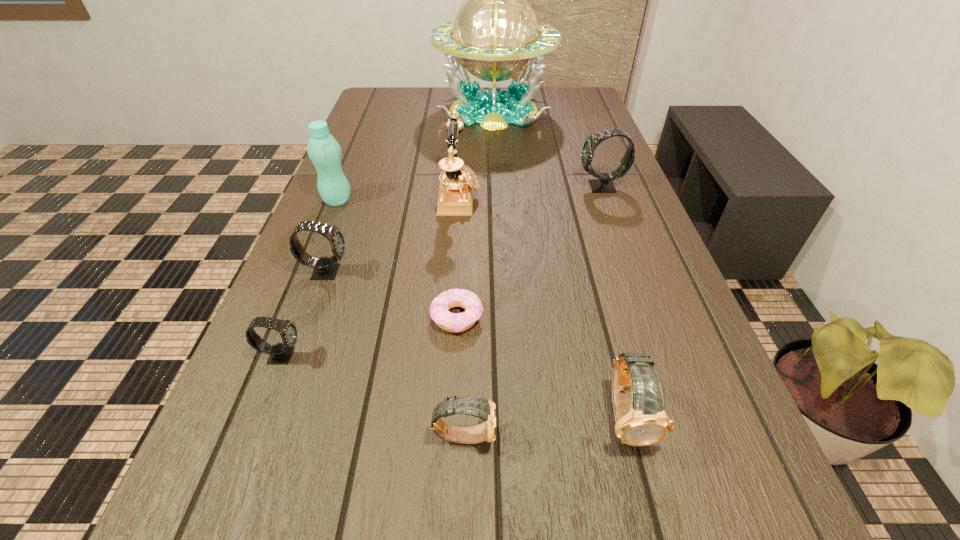
I want to click on free space at the far edge of the desktop, so click(428, 113).

Find the location of a particular element. vacant space at the left edge of the desktop is located at coordinates (380, 130).

Locate an element on the screen. This screenshot has width=960, height=540. blank area at the right edge is located at coordinates (621, 224).

Identify the location of free region at the far left corner. The width and height of the screenshot is (960, 540). (406, 96).

The image size is (960, 540). I want to click on unoccupied area between the second farthest gray watch and the third watch from right to left, so click(x=396, y=353).

You are a GUI agent. You are given a task and a screenshot of the screen. Output one action in this format:
    pyautogui.click(x=<x>, y=<y>)
    Task: Click on the free spot between the beige telephone and the pink doughnut
    The width and height of the screenshot is (960, 540).
    Given the screenshot: What is the action you would take?
    pyautogui.click(x=458, y=257)

At what (x,y) coordinates should I click in order to perform the action: click on free space between the bottle and the beige telephone. Please return your answer as a coordinate pair (x, y). Image resolution: width=960 pixels, height=540 pixels. Looking at the image, I should click on (398, 199).

The image size is (960, 540). I want to click on empty space that is in between the seventh farthest object and the bottle, so click(x=309, y=278).

At what (x,y) coordinates should I click in order to perform the action: click on empty space that is in between the bigger gold watch and the farthest object. Please return your answer as a coordinate pair (x, y). Looking at the image, I should click on (560, 264).

What are the coordinates of `free space between the globe and the nearest gray watch` in the screenshot? It's located at (388, 233).